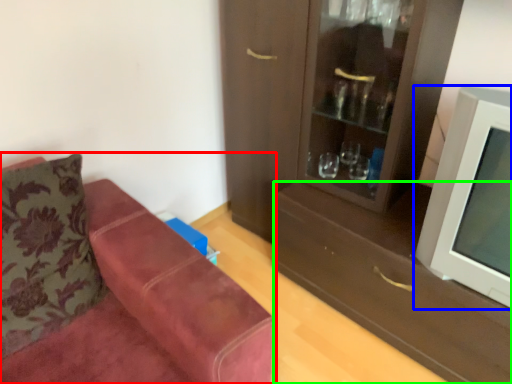
Question: Estimate the real-world distances between objects in this image. Which object is closer to studio couch (highlighted by a red box), television (highlighted by a blue box) or drawer (highlighted by a green box)?

Choices:
 (A) television
 (B) drawer

Answer: (B)